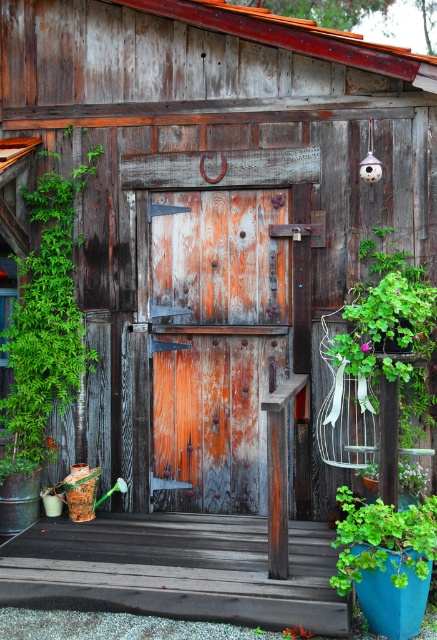
Can you confirm if dark brown wood porch at center is positioned below green leafy plant at center?

Incorrect, dark brown wood porch at center is not positioned below green leafy plant at center.

I want to click on dark brown wood porch at center, so click(x=176, y=570).

This screenshot has height=640, width=437. I want to click on dark brown wood porch at center, so click(x=176, y=570).

Can you confirm if weathered wood door at center is positioned below green leafy plant at center?

No, weathered wood door at center is not below green leafy plant at center.

Does weathered wood door at center have a smaller size compared to green leafy plant at center?

Incorrect, weathered wood door at center is not smaller in size than green leafy plant at center.

The image size is (437, 640). What are the coordinates of `weathered wood door at center` in the screenshot? It's located at (215, 342).

At what (x,y) coordinates should I click in order to perform the action: click on weathered wood door at center. Please return your answer as a coordinate pair (x, y). The width and height of the screenshot is (437, 640). Looking at the image, I should click on (215, 342).

Can you confirm if dark brown wood porch at center is positioned to the right of green leafy plant at right?

Incorrect, dark brown wood porch at center is not on the right side of green leafy plant at right.

Can you confirm if dark brown wood porch at center is bigger than green leafy plant at right?

Result: No, dark brown wood porch at center is not bigger than green leafy plant at right.

Which is behind, point (305, 524) or point (403, 390)?

Positioned behind is point (305, 524).

Locate an element on the screen. This screenshot has height=640, width=437. dark brown wood porch at center is located at coordinates (176, 570).